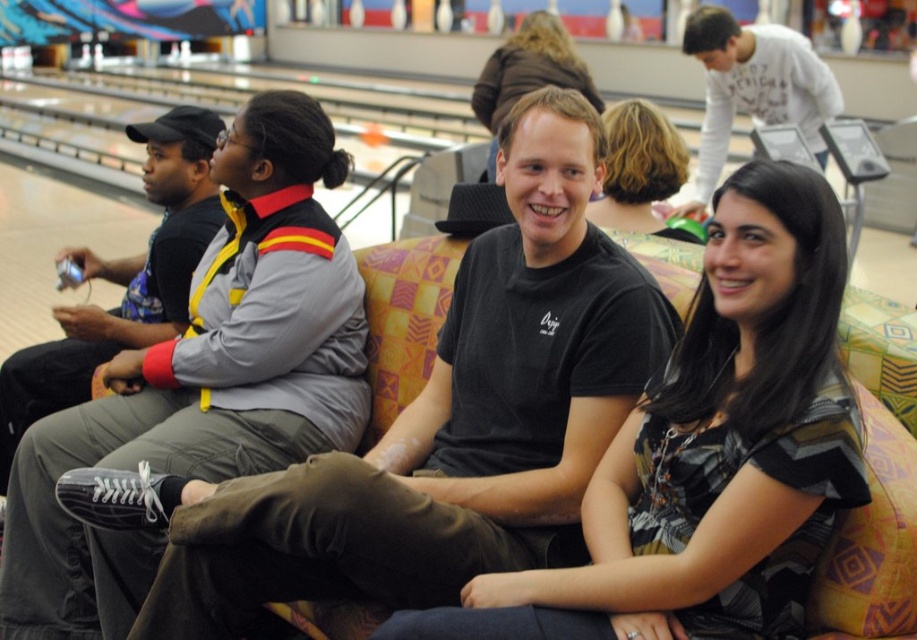
You are a photographer standing in the bowling alley and want to take a photo of both the black leather shoes at lower left and the dark brown hair at center. The minimum distance between the two objects must be maintained in the photo. Can you fit both into the frame if your camera has a maximum field of view that can capture objects up to 3 meters apart?

The black leather shoes at lower left and dark brown hair at center are 2.52 meters apart, which is within the camera field of view limit of 3 meters. Therefore, both objects can be captured in the same frame.

You are designing a new seating arrangement for the bowling alley lounge. You need to place a large rectangular table between the white cotton shirt at upper right and the matte black shirt at center. Which side of the table should face the wider shirt to ensure proper spacing?

The white cotton shirt at upper right is wider than the matte black shirt at center. To ensure proper spacing, the wider side of the table should face the white cotton shirt at upper right.

You are standing in the bowling alley and want to take a photo of the black leather shoes at lower left and the white cotton shirt at upper right. Which object should you focus on first if you want to capture both in the frame without moving the camera?

The black leather shoes at lower left should be focused on first since it is positioned on the left side of the white cotton shirt at upper right, allowing both to be captured in the frame by centering the camera between them.